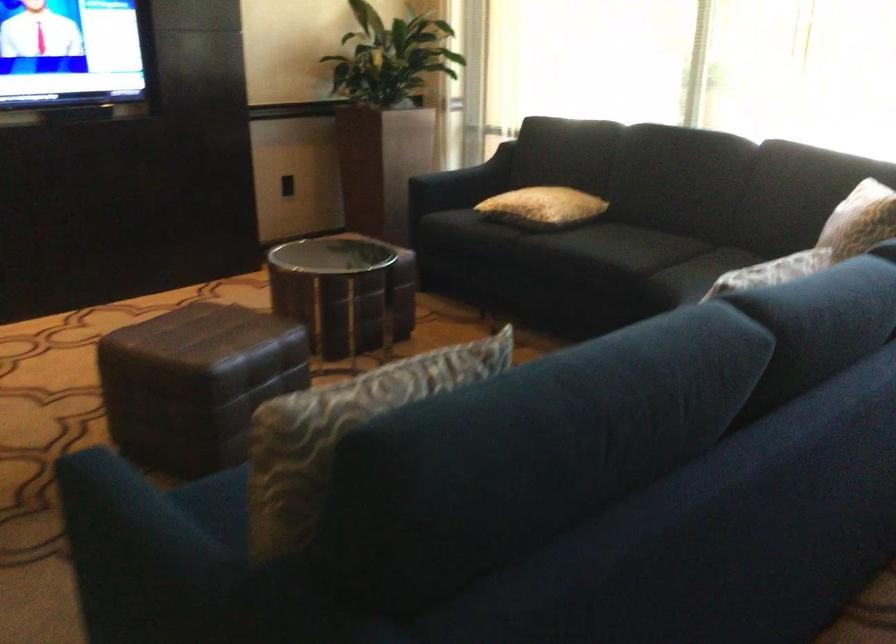
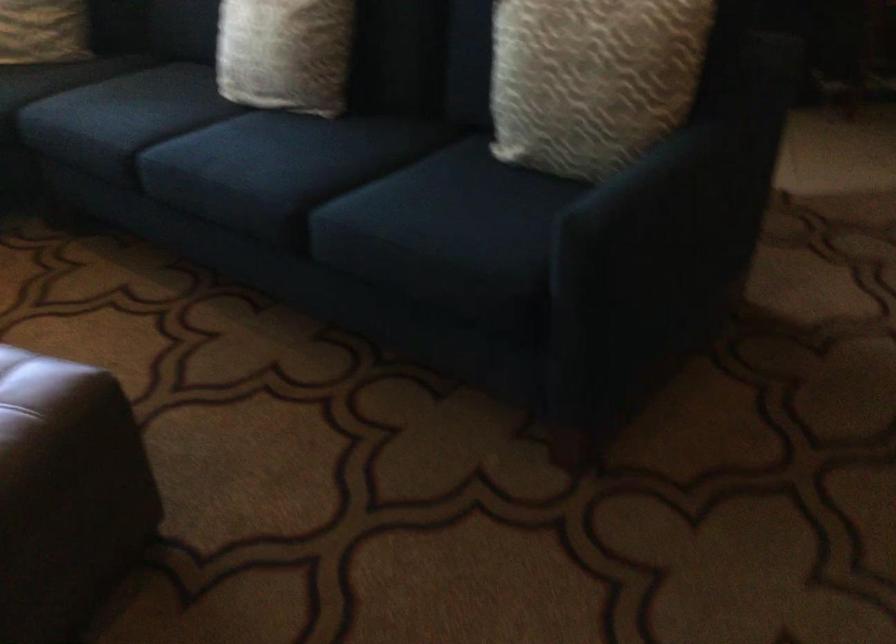
Where in the second image is the point corresponding to (x=195, y=383) from the first image?

(135, 391)